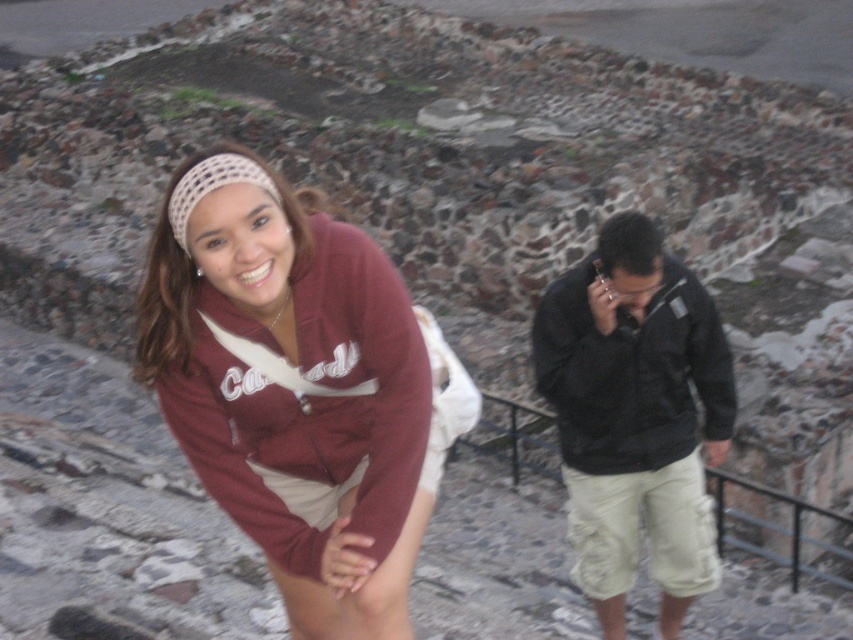
Question: Among these objects, which one is nearest to the camera?

Choices:
 (A) matte maroon hoodie at center
 (B) black matte jacket at right

Answer: (A)

Question: Is matte maroon hoodie at center wider than black matte jacket at right?

Choices:
 (A) no
 (B) yes

Answer: (B)

Question: Where is matte maroon hoodie at center located in relation to black matte jacket at right in the image?

Choices:
 (A) above
 (B) below

Answer: (A)

Question: Can you confirm if matte maroon hoodie at center is smaller than black matte jacket at right?

Choices:
 (A) no
 (B) yes

Answer: (A)

Question: Which point is closer to the camera?

Choices:
 (A) (590, 588)
 (B) (337, 435)

Answer: (B)

Question: Among these objects, which one is nearest to the camera?

Choices:
 (A) matte maroon hoodie at center
 (B) black matte jacket at right

Answer: (A)